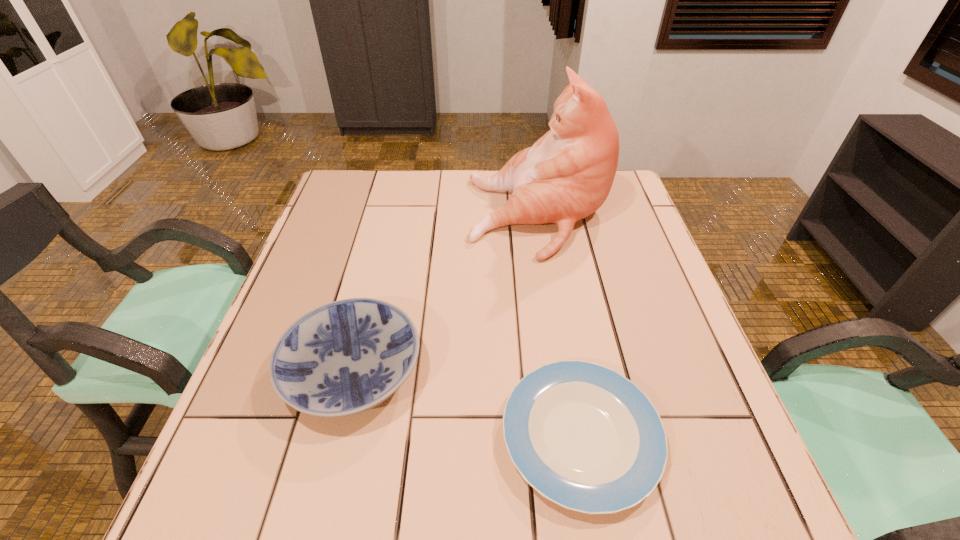
Locate an element on the screen. The height and width of the screenshot is (540, 960). the farthest object is located at coordinates (567, 174).

At what (x,y) coordinates should I click in order to perform the action: click on the tallest object. Please return your answer as a coordinate pair (x, y). Looking at the image, I should click on (567, 174).

The image size is (960, 540). I want to click on the left plate, so click(343, 358).

Where is `the leftmost object`? Image resolution: width=960 pixels, height=540 pixels. the leftmost object is located at coordinates (343, 358).

The image size is (960, 540). I want to click on the right plate, so click(585, 437).

Find the location of a particular element. the shortest object is located at coordinates (585, 437).

What are the coordinates of `blank space located 0.360m on the face of the farthest object` in the screenshot? It's located at (343, 217).

This screenshot has width=960, height=540. In order to click on vacant area situated on the face of the farthest object in this screenshot , I will do coord(413,217).

The height and width of the screenshot is (540, 960). In order to click on vacant space located on the face of the farthest object in this screenshot , I will do `click(409, 217)`.

What are the coordinates of `vacant region located 0.380m on the right of the leftmost object` in the screenshot? It's located at [x=611, y=370].